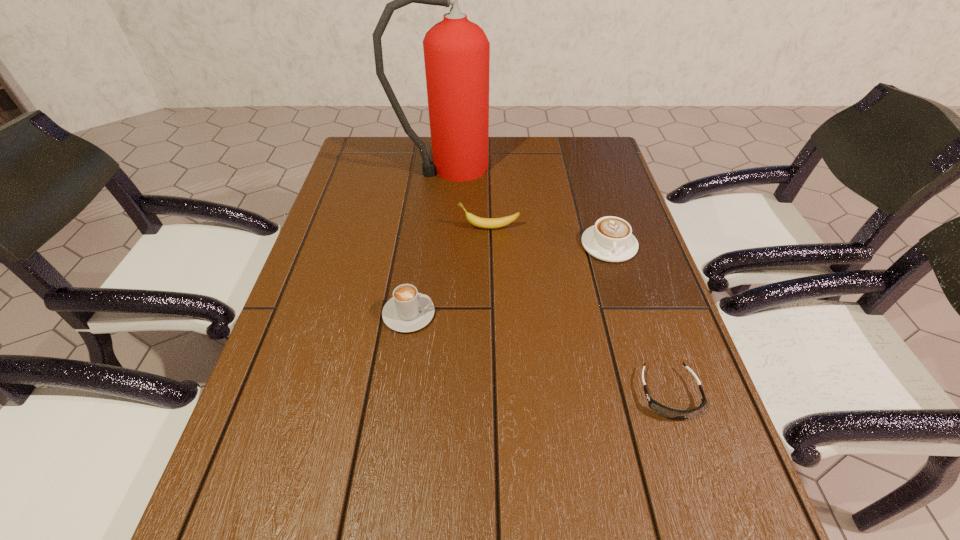
What are the coordinates of `the farthest object` in the screenshot? It's located at (456, 51).

Where is `fire extinguisher`? fire extinguisher is located at coordinates (456, 51).

Where is `banana`? The height and width of the screenshot is (540, 960). banana is located at coordinates (487, 223).

Locate an element on the screen. This screenshot has height=540, width=960. the left cappuccino is located at coordinates (407, 311).

This screenshot has width=960, height=540. I want to click on the nearer cappuccino, so click(x=407, y=311).

Where is `the right cappuccino`? the right cappuccino is located at coordinates pos(610,239).

Find the location of a particular element. Image resolution: width=960 pixels, height=540 pixels. the farther cappuccino is located at coordinates (610, 239).

Image resolution: width=960 pixels, height=540 pixels. I want to click on the shortest object, so 669,413.

Image resolution: width=960 pixels, height=540 pixels. I want to click on the nearest object, so click(669, 413).

Find the location of a particular element. vacant space situated on the handle side of the fire extinguisher is located at coordinates (523, 167).